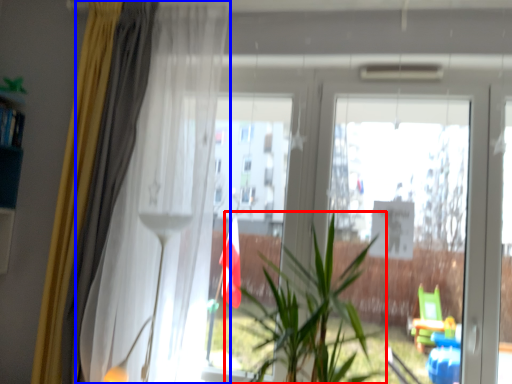
Question: Which point is closer to the camera, houseplant (highlighted by a red box) or curtain (highlighted by a blue box)?

Choices:
 (A) houseplant
 (B) curtain

Answer: (A)